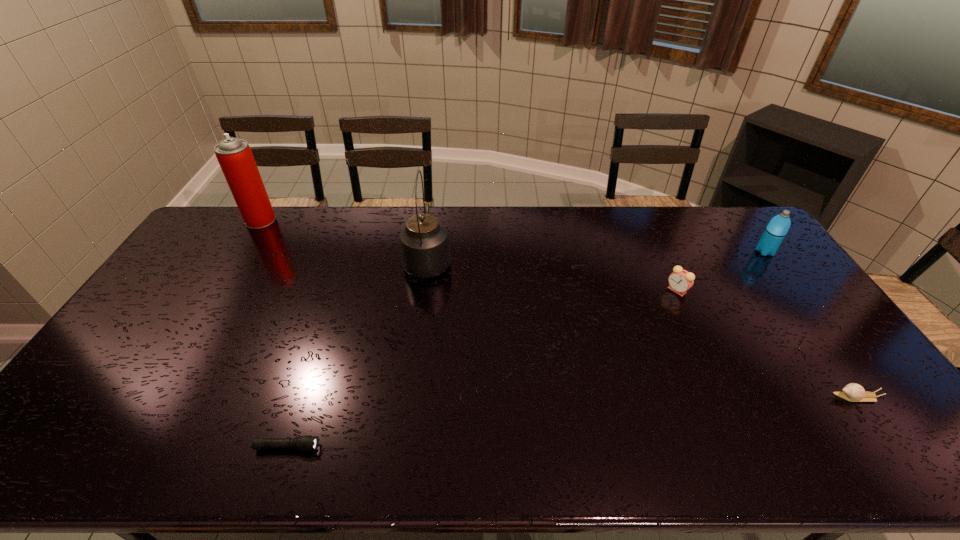
This screenshot has height=540, width=960. Identify the location of free space between the second object from left to right and the third tallest object. (526, 349).

The image size is (960, 540). What are the coordinates of `free space between the second object from left to right and the fourth object from right to left` in the screenshot? It's located at point(357,354).

You are a GUI agent. You are given a task and a screenshot of the screen. Output one action in this format:
    pyautogui.click(x=<x>, y=<y>)
    Task: Click on the empty space between the second object from left to right and the third object from left to right
    Image resolution: width=960 pixels, height=540 pixels.
    Given the screenshot: What is the action you would take?
    357,354

Image resolution: width=960 pixels, height=540 pixels. Find the location of `vacant point located between the aerosol can and the kettle`. vacant point located between the aerosol can and the kettle is located at coordinates (344, 240).

The image size is (960, 540). In order to click on the third closest object to the kettle in this screenshot , I will do `click(680, 281)`.

The height and width of the screenshot is (540, 960). I want to click on object identified as the third closest to the farthest object, so click(x=680, y=281).